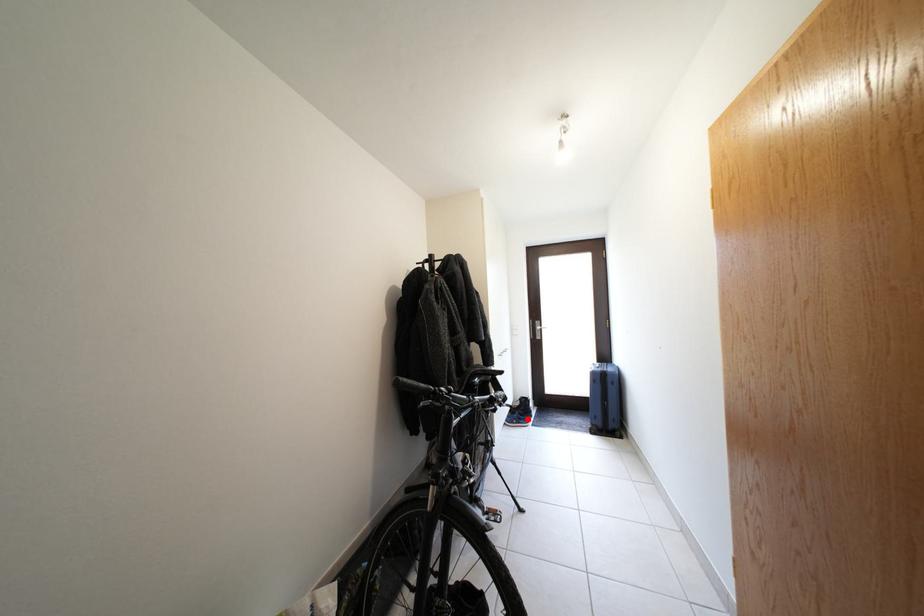
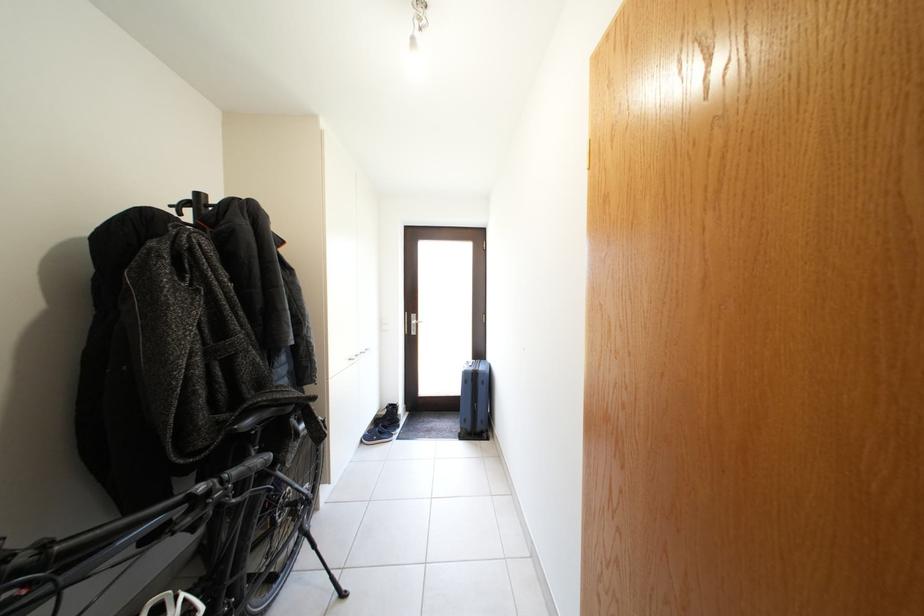
The point at the highlighted location is marked in the first image. Where is the corresponding point in the second image?

(392, 431)